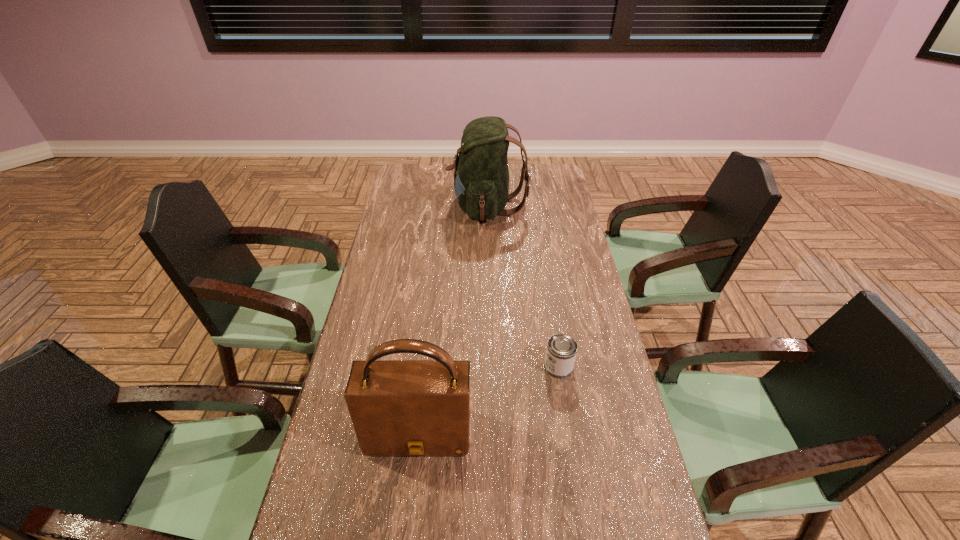
Locate an element on the screen. Image resolution: width=960 pixels, height=540 pixels. the farthest object is located at coordinates (481, 174).

The height and width of the screenshot is (540, 960). What are the coordinates of `the nearest object` in the screenshot? It's located at (398, 407).

You are a GUI agent. You are given a task and a screenshot of the screen. Output one action in this format:
    pyautogui.click(x=<x>, y=<y>)
    Task: Click on the second farthest object
    The width and height of the screenshot is (960, 540).
    Given the screenshot: What is the action you would take?
    pyautogui.click(x=561, y=351)

I want to click on can, so click(561, 351).

Image resolution: width=960 pixels, height=540 pixels. In order to click on vacant space located on the open flap of the farthest object in this screenshot , I will do `click(405, 207)`.

Find the location of `free space located on the open flap of the farthest object`. free space located on the open flap of the farthest object is located at coordinates (432, 207).

Where is `vacant region located 0.260m on the open flap of the farthest object`? vacant region located 0.260m on the open flap of the farthest object is located at coordinates (390, 207).

The height and width of the screenshot is (540, 960). I want to click on free space located 0.100m on the front flap of the nearest object, so click(411, 501).

Find the location of a particular element. The width and height of the screenshot is (960, 540). free region located on the left of the can is located at coordinates (444, 367).

At what (x,y) coordinates should I click in order to perform the action: click on object that is positioned at the far edge. Please return your answer as a coordinate pair (x, y). This screenshot has height=540, width=960. Looking at the image, I should click on (481, 174).